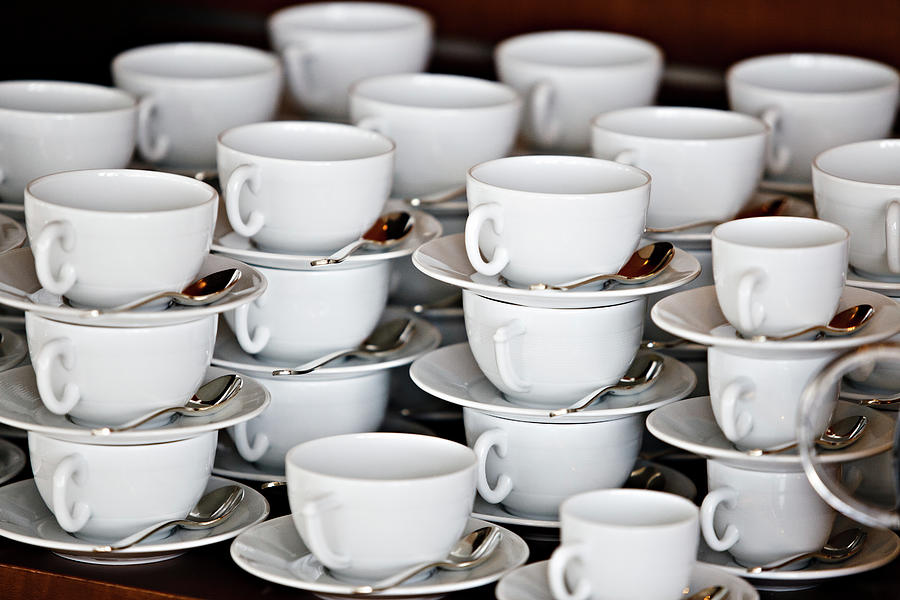
Identify the location of top right cup upper right side. Image resolution: width=900 pixels, height=600 pixels. (834, 77).